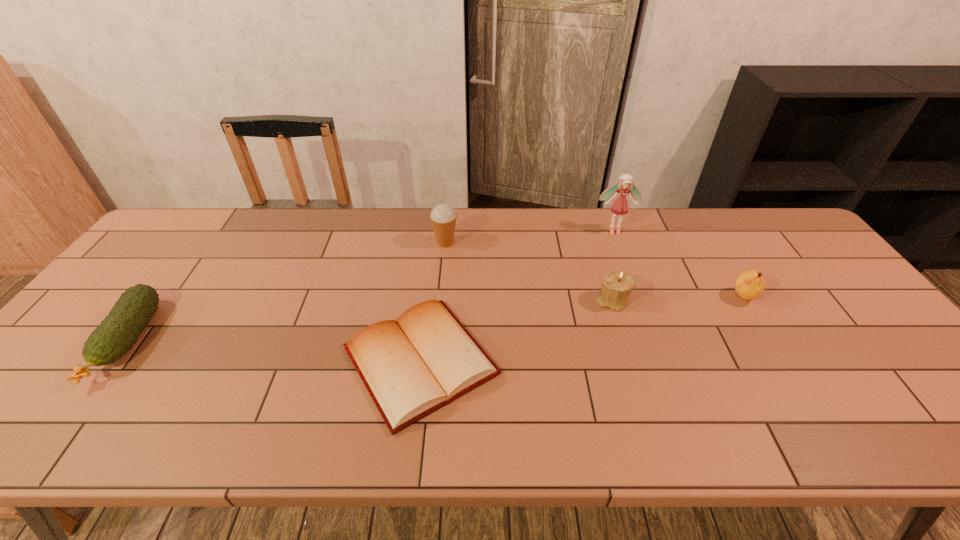
Where is `vacant space at the right edge of the desktop`? The image size is (960, 540). vacant space at the right edge of the desktop is located at coordinates (884, 383).

In order to click on vacant space at the far left corner of the desktop in this screenshot , I will do (x=218, y=213).

In the image, there is a desktop. Identify the location of vacant region at the near left corner. The image size is (960, 540). (60, 442).

In order to click on blank space at the near right corner of the desktop in this screenshot , I will do `click(953, 445)`.

Locate an element on the screen. The height and width of the screenshot is (540, 960). vacant space in between the second shortest object and the doll is located at coordinates (371, 286).

This screenshot has height=540, width=960. In order to click on empty space that is in between the cucumber and the candle_holder in this screenshot , I will do `click(370, 321)`.

Where is `vacant area that lies between the candle_holder and the tallest object`? The image size is (960, 540). vacant area that lies between the candle_holder and the tallest object is located at coordinates (612, 266).

Where is `vacant region between the shortest object and the tallest object`? The height and width of the screenshot is (540, 960). vacant region between the shortest object and the tallest object is located at coordinates (517, 295).

Where is `free point between the second shortest object and the icecream`? The width and height of the screenshot is (960, 540). free point between the second shortest object and the icecream is located at coordinates (286, 292).

You are a GUI agent. You are given a task and a screenshot of the screen. Output one action in this format:
    pyautogui.click(x=<x>, y=<y>)
    Task: Click on the free spot between the icecream and the rightmost object
    The width and height of the screenshot is (960, 540).
    Given the screenshot: What is the action you would take?
    pyautogui.click(x=594, y=269)